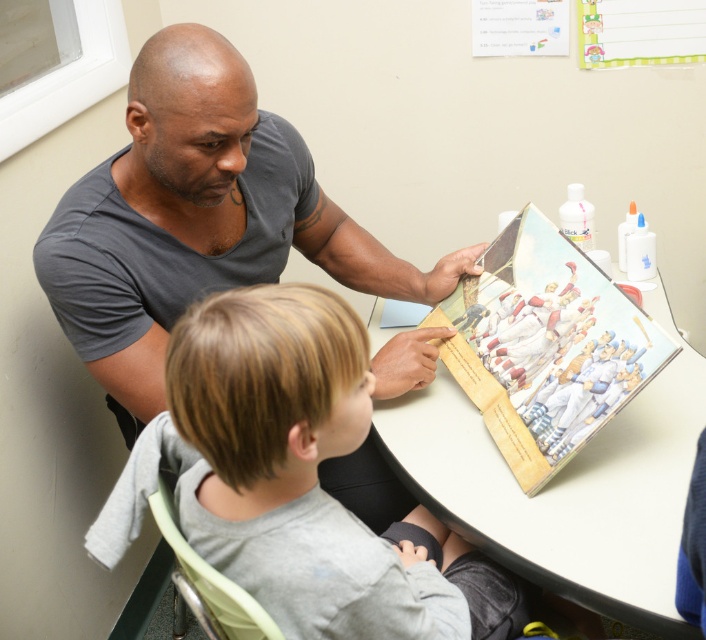
Question: Which of the following is the farthest from the observer?

Choices:
 (A) light brown hair at upper center
 (B) gray matte shirt at upper left
 (C) white glossy table at center
 (D) green textured paper at upper right

Answer: (D)

Question: Can you confirm if light brown hair at upper center is bigger than green textured paper at upper right?

Choices:
 (A) no
 (B) yes

Answer: (B)

Question: Does gray matte shirt at upper left have a greater width compared to light brown hair at upper center?

Choices:
 (A) no
 (B) yes

Answer: (B)

Question: Among these points, which one is farthest from the camera?

Choices:
 (A) (621, 586)
 (B) (400, 520)
 (C) (630, 17)

Answer: (C)

Question: Which point is closer to the camera?

Choices:
 (A) (265, 422)
 (B) (659, 310)
 (C) (666, 19)
 (D) (104, 380)

Answer: (A)

Question: Is light brown hair at upper center to the left of green textured paper at upper right from the viewer's perspective?

Choices:
 (A) no
 (B) yes

Answer: (B)